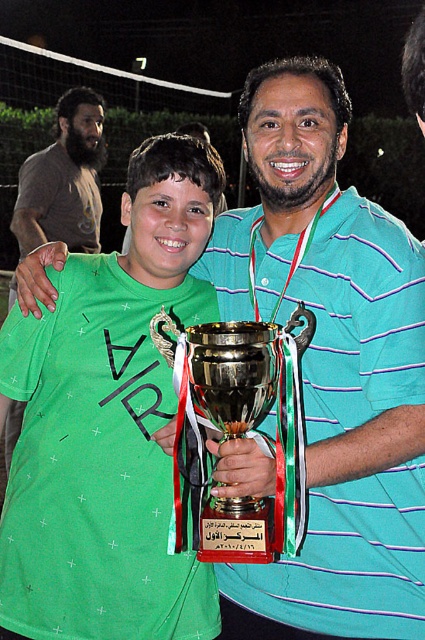
You are a photographer at a sports event and need to adjust your camera to focus on the green matte shirt at center. What are the coordinates where you should aim your camera?

The green matte shirt at center is located at coordinates point (108, 424). Aim your camera there to focus on it.